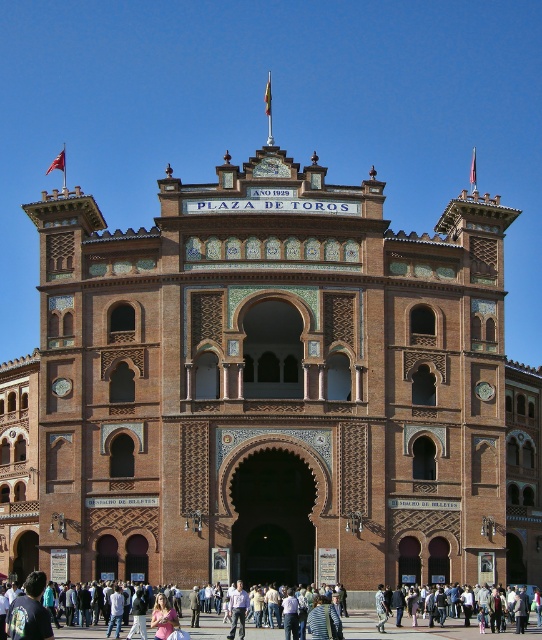
You are attending a cultural event at the Plaza de Toros in Madrid and notice two items in the lower center of the arena. Which item is positioned to the left of the other? The items are the light pink fabric dress at lower center and the light brown leather jacket at lower center.

The light pink fabric dress at lower center is positioned to the left of the light brown leather jacket at lower center.

You are attending a cultural event at the Plaza de Toros in Madrid. You notice two attendees dressed in a light pink fabric dress at lower center and a light blue shirt at center. From your perspective, which clothing item is positioned to the right of the other?

The light pink fabric dress at lower center is to the right of the light blue shirt at center.